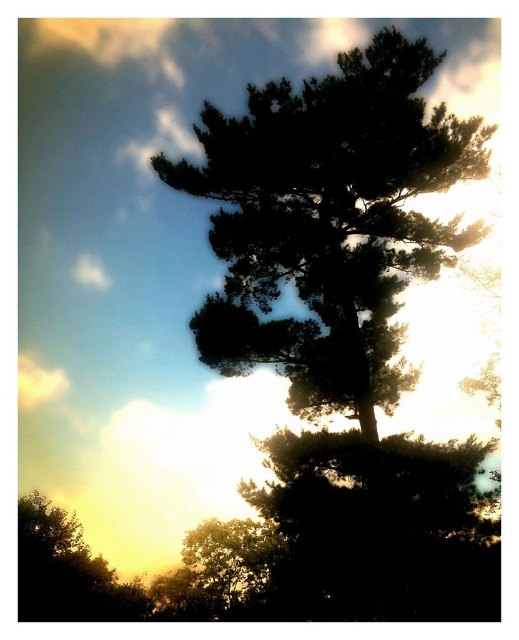
Between silhouette pine at center and green leafy tree at lower left, which one is positioned higher?

silhouette pine at center is above.

Does silhouette pine at center have a larger size compared to green leafy tree at lower left?

Correct, silhouette pine at center is larger in size than green leafy tree at lower left.

Is point (293, 134) more distant than point (83, 540)?

No, it is in front of (83, 540).

In order to click on silhouette pine at center in this screenshot , I will do `click(330, 221)`.